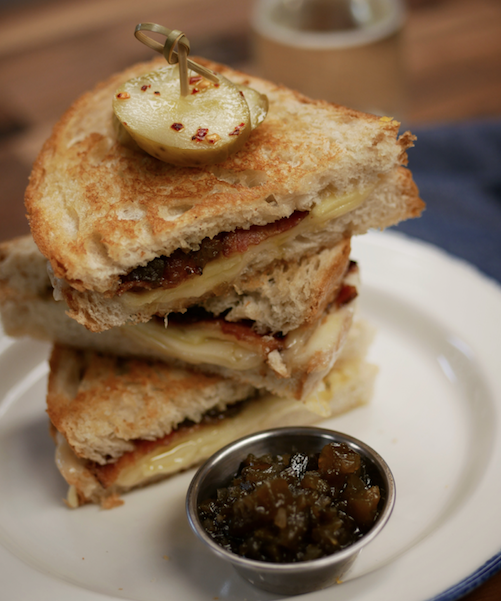
This screenshot has height=601, width=501. In order to click on table in this screenshot , I will do `click(463, 79)`.